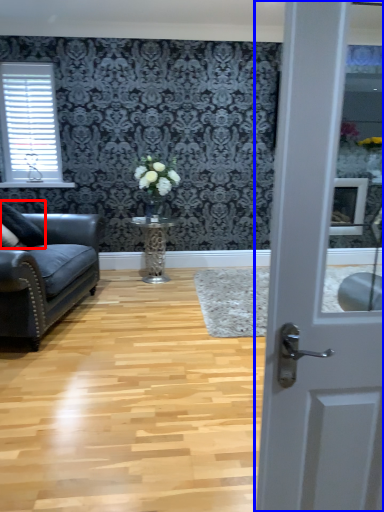
Question: Among these objects, which one is farthest to the camera, pillow (highlighted by a red box) or door (highlighted by a blue box)?

Choices:
 (A) pillow
 (B) door

Answer: (A)